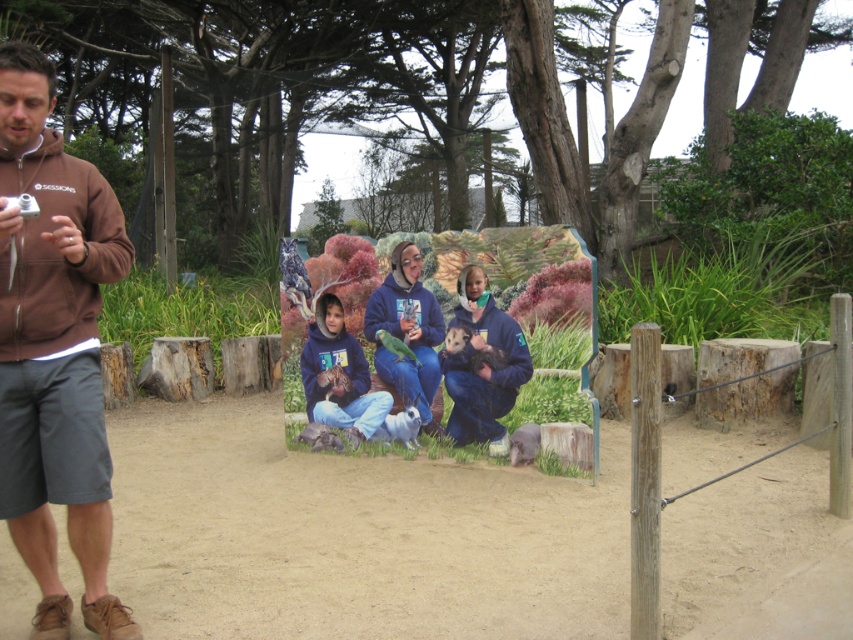
You are a visitor at the zoo and want to take a photo of the matte blue jacket at center without the brown hoodie at left appearing in the shot. Is this possible given their positions?

The brown hoodie at left is positioned over the matte blue jacket at center, so it would block the view. You need to move to the side to avoid the brown hoodie at left obstructing the matte blue jacket at center.

You are standing at the point labeled as point (54,348) in the image. What object is directly in front of you?

The point (54,348) corresponds to the brown hoodie at left, so the brown hoodie at left is directly in front of you.

You are standing in the zoo and see the brown hoodie at left and the matte blue jacket at center. Which one is nearer to you?

The brown hoodie at left is closer to the viewer than the matte blue jacket at center.